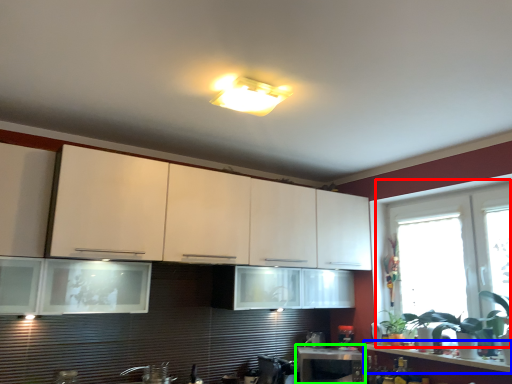
Question: Which is nearer to the window (highlighted by a red box)? countertop (highlighted by a blue box) or table (highlighted by a green box).

Choices:
 (A) countertop
 (B) table

Answer: (A)